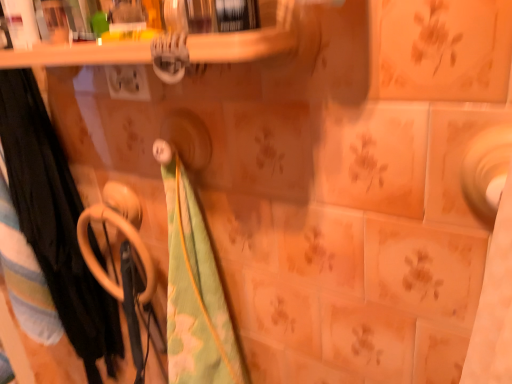
Question: Is the depth of matte ceramic tile at right less than that of green floral fabric at center, arranged as the third beach towel when viewed from the left?

Choices:
 (A) no
 (B) yes

Answer: (B)

Question: Does matte ceramic tile at right have a greater width compared to green floral fabric at center, which is the 1th beach towel from right to left?

Choices:
 (A) yes
 (B) no

Answer: (B)

Question: Could you tell me if matte ceramic tile at right is facing green floral fabric at center, which is the 1th beach towel from right to left?

Choices:
 (A) no
 (B) yes

Answer: (A)

Question: From the image's perspective, is matte ceramic tile at right located above green floral fabric at center, arranged as the third beach towel when viewed from the left?

Choices:
 (A) no
 (B) yes

Answer: (B)

Question: Are matte ceramic tile at right and green floral fabric at center, which is the 1th beach towel from right to left, making contact?

Choices:
 (A) yes
 (B) no

Answer: (B)

Question: From a real-world perspective, is matte ceramic tile at right positioned under green floral fabric at center, which is the 1th beach towel from right to left, based on gravity?

Choices:
 (A) no
 (B) yes

Answer: (A)

Question: Is black fabric towel at left, which is the 3th beach towel from right to left, oriented away from matte ceramic tile at right?

Choices:
 (A) yes
 (B) no

Answer: (B)

Question: From a real-world perspective, is black fabric towel at left, the first beach towel from the left, on top of matte ceramic tile at right?

Choices:
 (A) yes
 (B) no

Answer: (B)

Question: Considering the relative positions of black fabric towel at left, which is the 3th beach towel from right to left, and matte ceramic tile at right in the image provided, is black fabric towel at left, which is the 3th beach towel from right to left, to the left of matte ceramic tile at right from the viewer's perspective?

Choices:
 (A) yes
 (B) no

Answer: (A)

Question: From a real-world perspective, does black fabric towel at left, the first beach towel from the left, sit lower than matte ceramic tile at right?

Choices:
 (A) yes
 (B) no

Answer: (A)

Question: Can you confirm if black fabric towel at left, the first beach towel from the left, is wider than matte ceramic tile at right?

Choices:
 (A) no
 (B) yes

Answer: (B)

Question: Is black fabric towel at left, the first beach towel from the left, closer to camera compared to matte ceramic tile at right?

Choices:
 (A) yes
 (B) no

Answer: (B)

Question: From a real-world perspective, is beige plastic towel rack at lower left physically above matte ceramic tile at right?

Choices:
 (A) yes
 (B) no

Answer: (B)